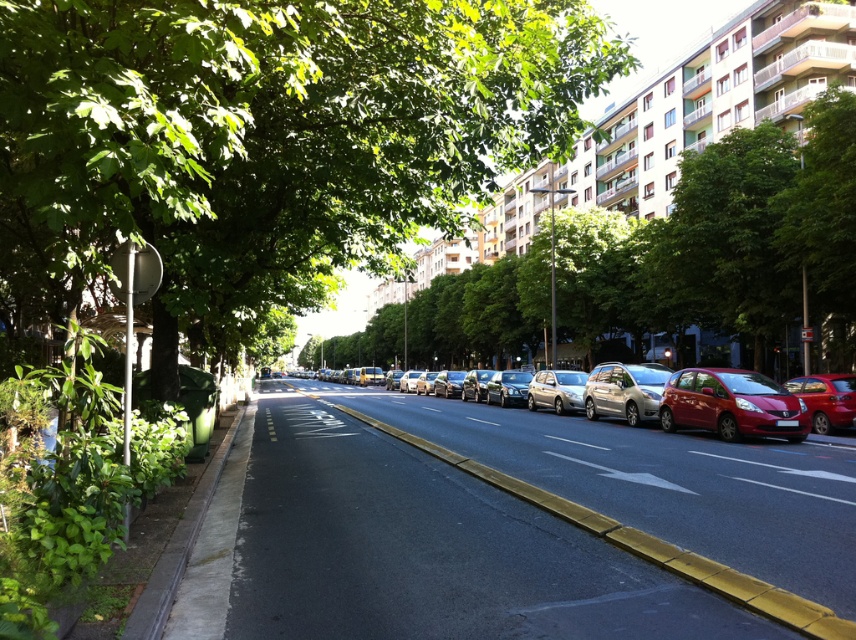
Who is positioned more to the left, green leafy tree at upper center or satin silver sedan at center?

From the viewer's perspective, green leafy tree at upper center appears more on the left side.

The image size is (856, 640). What do you see at coordinates (727, 243) in the screenshot? I see `green leafy tree at upper center` at bounding box center [727, 243].

Is point (584, 276) in front of point (551, 388)?

No, it is behind (551, 388).

Identify the location of green leafy tree at upper center. This screenshot has height=640, width=856. point(727,243).

Between point (423, 99) and point (559, 408), which one is positioned behind?

The point (559, 408) is behind.

Which is below, green leafy tree at center or satin silver sedan at center?

satin silver sedan at center is below.

You are a GUI agent. You are given a task and a screenshot of the screen. Output one action in this format:
    pyautogui.click(x=<x>, y=<y>)
    Task: Click on the green leafy tree at center
    The image size is (856, 640).
    Given the screenshot: What is the action you would take?
    pyautogui.click(x=266, y=141)

The height and width of the screenshot is (640, 856). Identify the location of green leafy tree at center. click(266, 141).

Between shiny red car at right and satin silver car at center, which one is positioned lower?

shiny red car at right is lower down.

Which of these two, shiny red car at right or satin silver car at center, stands shorter?

Standing shorter between the two is shiny red car at right.

What do you see at coordinates (730, 404) in the screenshot? I see `shiny red car at right` at bounding box center [730, 404].

I want to click on shiny red car at right, so click(730, 404).